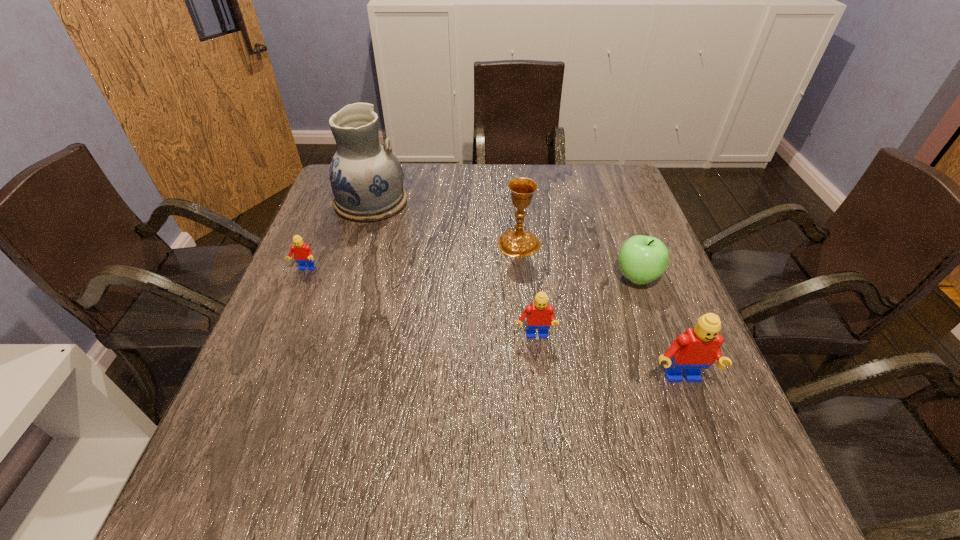
Please point a spot to place another Lego for symmetrical spacing. Please provide its 2D coordinates. Your answer should be formatted as a tuple, i.e. [(x, y)], where the tuple contains the x and y coordinates of a point satisfying the conditions above.

[(411, 301)]